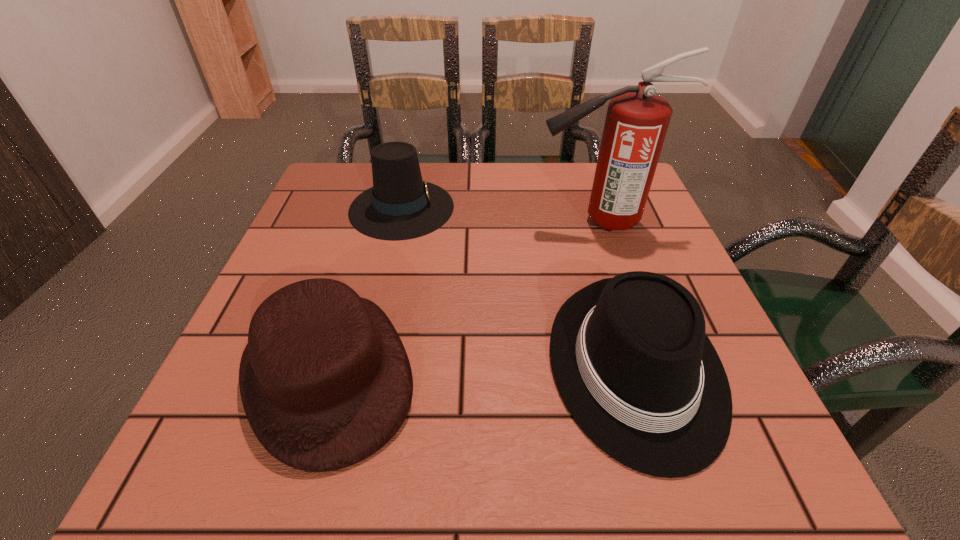
Locate an element on the screen. fire extinguisher is located at coordinates (637, 120).

Find the location of a particular element. the farther hat is located at coordinates (400, 206).

Where is `fedora`? fedora is located at coordinates pyautogui.click(x=630, y=356).

Identify the location of the shorter hat. This screenshot has height=540, width=960. (325, 381).

At what (x,y) coordinates should I click in order to perform the action: click on blank space located at the nozzle of the tallest object. Please return your answer as a coordinate pair (x, y). The height and width of the screenshot is (540, 960). Looking at the image, I should click on (416, 221).

Find the location of `vacant space situated 0.360m at the nozzle of the tallest object`. vacant space situated 0.360m at the nozzle of the tallest object is located at coordinates (375, 221).

Find the location of `vacant space situated at the nozzle of the tallest object`. vacant space situated at the nozzle of the tallest object is located at coordinates (482, 221).

Where is `vacant region located on the front-facing side of the taller hat`? Image resolution: width=960 pixels, height=540 pixels. vacant region located on the front-facing side of the taller hat is located at coordinates (616, 207).

Identify the location of vacant area situated 0.300m on the back of the shorter hat. The image size is (960, 540). (378, 208).

Where is `fire extinguisher present at the far edge`? This screenshot has width=960, height=540. fire extinguisher present at the far edge is located at coordinates (637, 120).